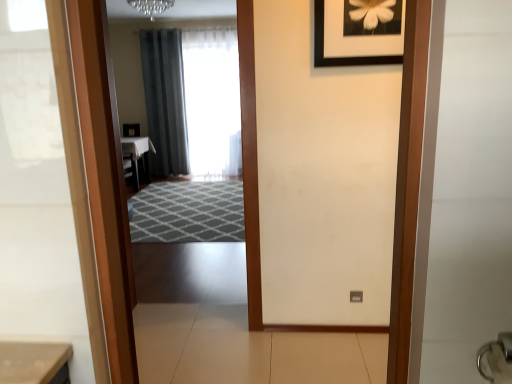
Question: In the image, is crystal glass chandelier at upper center positioned in front of or behind dark gray fabric curtain at center, acting as the first curtain starting from the left?

Choices:
 (A) front
 (B) behind

Answer: (A)

Question: From a real-world perspective, relative to dark gray fabric curtain at center, which appears as the 2th curtain when viewed from the right, is crystal glass chandelier at upper center vertically above or below?

Choices:
 (A) above
 (B) below

Answer: (A)

Question: Which object is positioned closest to the crystal glass chandelier at upper center?

Choices:
 (A) black matte picture frame at upper center
 (B) transparent glass mirror at center
 (C) silver metallic door handle at lower right
 (D) dark gray fabric curtain at center, which appears as the 2th curtain when viewed from the right
 (E) white glossy table at center

Answer: (D)

Question: Estimate the real-world distances between objects in this image. Which object is farther from the black matte picture frame at upper center?

Choices:
 (A) dark gray fabric curtain at center, acting as the first curtain starting from the left
 (B) transparent glass mirror at center
 (C) silver metallic door handle at lower right
 (D) crystal glass chandelier at upper center
 (E) white glossy table at center

Answer: (A)